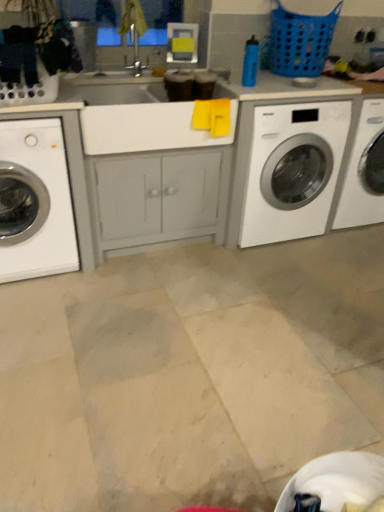
Question: Considering the positions of blue plastic laundry basket at upper right and white glossy washing machine at center right, which is counted as the first washing machine, starting from the right, in the image, is blue plastic laundry basket at upper right taller or shorter than white glossy washing machine at center right, which is counted as the first washing machine, starting from the right,?

Choices:
 (A) short
 (B) tall

Answer: (A)

Question: From the image's perspective, is blue plastic laundry basket at upper right positioned above or below white glossy washing machine at center right, the 2th washing machine from the left?

Choices:
 (A) above
 (B) below

Answer: (A)

Question: Which is nearer to the blue plastic laundry basket at upper right?

Choices:
 (A) white glossy washing machine at center right, the 2th washing machine from the left
 (B) white glossy washing machine at left, which ranks as the 1th washing machine in left-to-right order

Answer: (A)

Question: Which object is the closest to the white glossy washing machine at left, positioned as the second washing machine in right-to-left order?

Choices:
 (A) blue plastic laundry basket at upper right
 (B) white glossy washing machine at center right, which is counted as the first washing machine, starting from the right

Answer: (B)